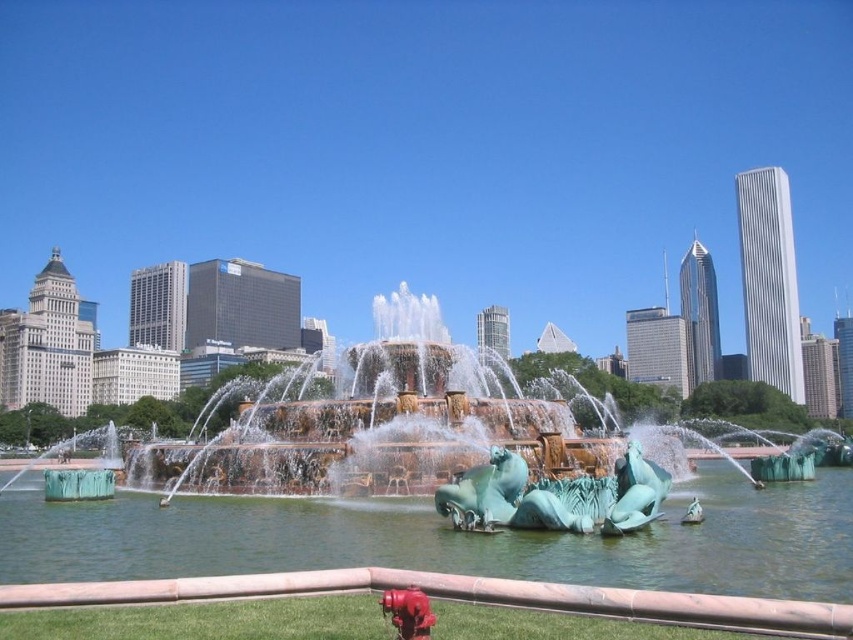
Question: Which point is farther to the camera?

Choices:
 (A) (643, 518)
 (B) (671, 534)

Answer: (B)

Question: Does green patina water at center appear over bronze sculpture at center?

Choices:
 (A) yes
 (B) no

Answer: (B)

Question: Does bronze sculpture at center have a larger size compared to green patina horse at center?

Choices:
 (A) no
 (B) yes

Answer: (B)

Question: Which point is closer to the camera taking this photo?

Choices:
 (A) (479, 468)
 (B) (744, 520)

Answer: (A)

Question: Based on their relative distances, which object is farther from the red matte hydrant at lower center?

Choices:
 (A) green marble horse at center
 (B) green patina horse at center

Answer: (B)

Question: Where is green patina water at center located in relation to red matte hydrant at lower center in the image?

Choices:
 (A) left
 (B) right

Answer: (A)